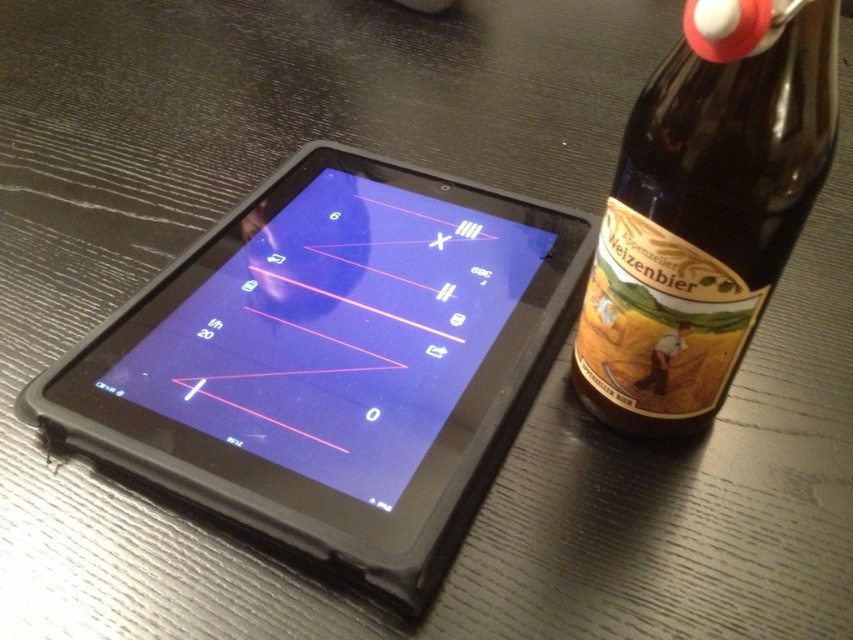
Question: Is black rubberized tablet at center above brown glass bottle at right?

Choices:
 (A) yes
 (B) no

Answer: (B)

Question: Can you confirm if black rubberized tablet at center is positioned to the left of brown glass bottle at right?

Choices:
 (A) yes
 (B) no

Answer: (A)

Question: Which point is closer to the camera taking this photo?

Choices:
 (A) (793, 38)
 (B) (247, 202)

Answer: (A)

Question: Among these points, which one is nearest to the camera?

Choices:
 (A) (735, 236)
 (B) (228, 288)

Answer: (A)

Question: Considering the relative positions of black rubberized tablet at center and brown glass bottle at right in the image provided, where is black rubberized tablet at center located with respect to brown glass bottle at right?

Choices:
 (A) below
 (B) above

Answer: (A)